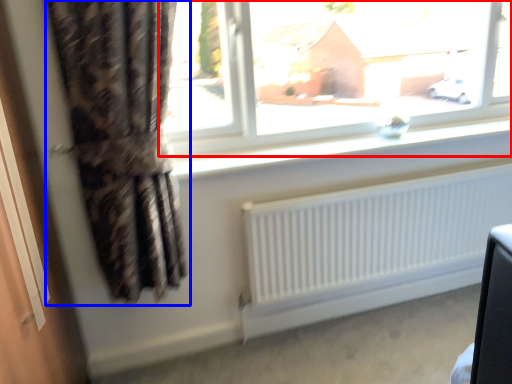
Question: Which object appears closest to the camera in this image, window (highlighted by a red box) or curtain (highlighted by a blue box)?

Choices:
 (A) window
 (B) curtain

Answer: (B)